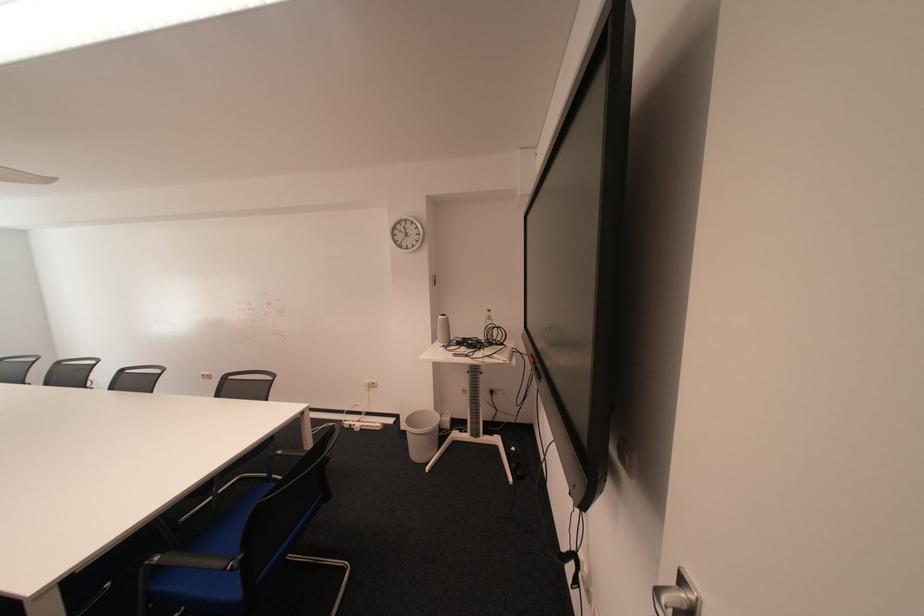
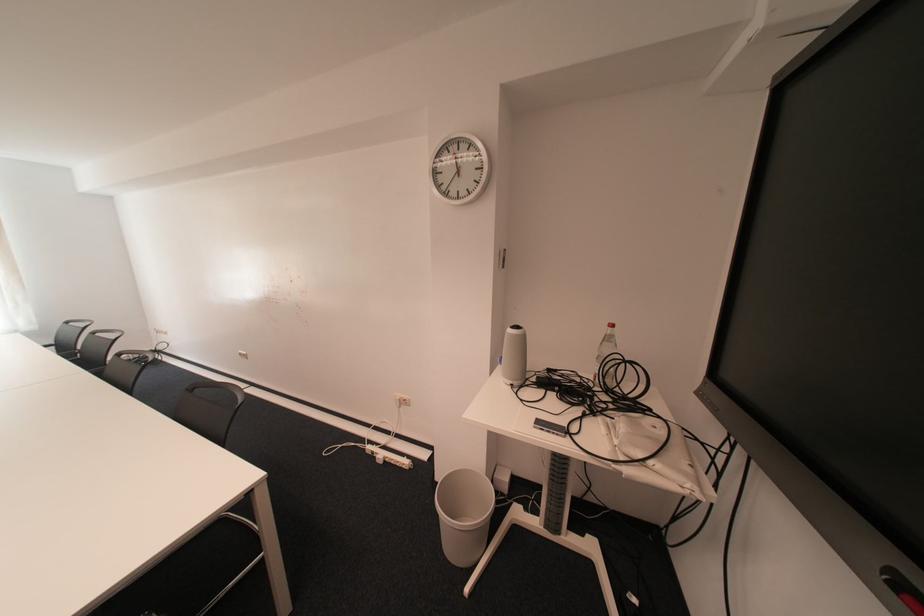
Locate, in the second image, the point that corresponds to (x=454, y=345) in the first image.

(520, 383)